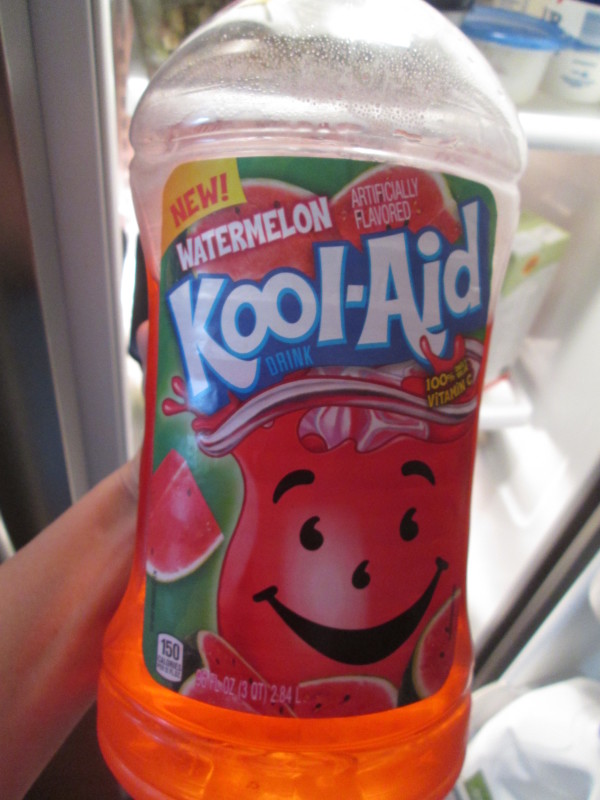
The image size is (600, 800). I want to click on open fridge, so click(x=528, y=265).